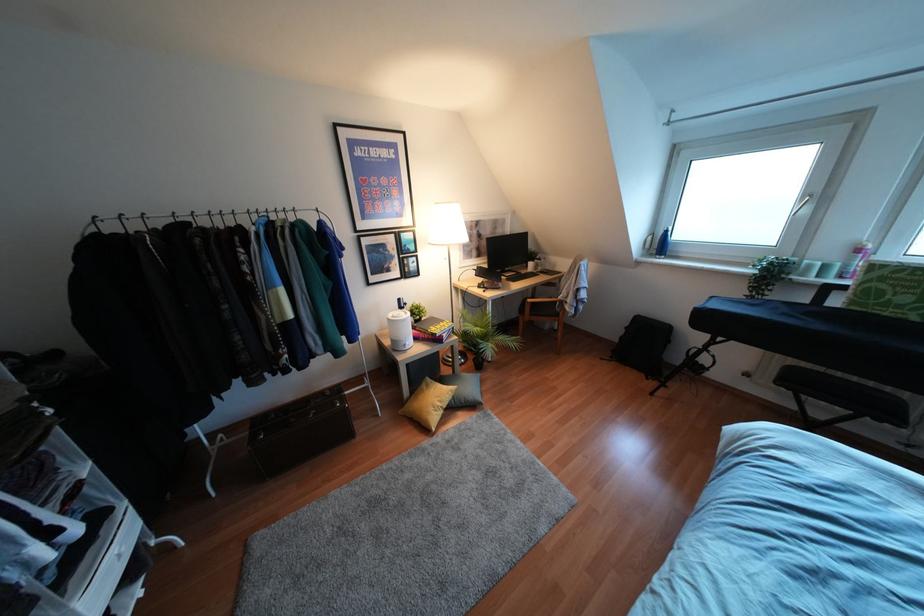
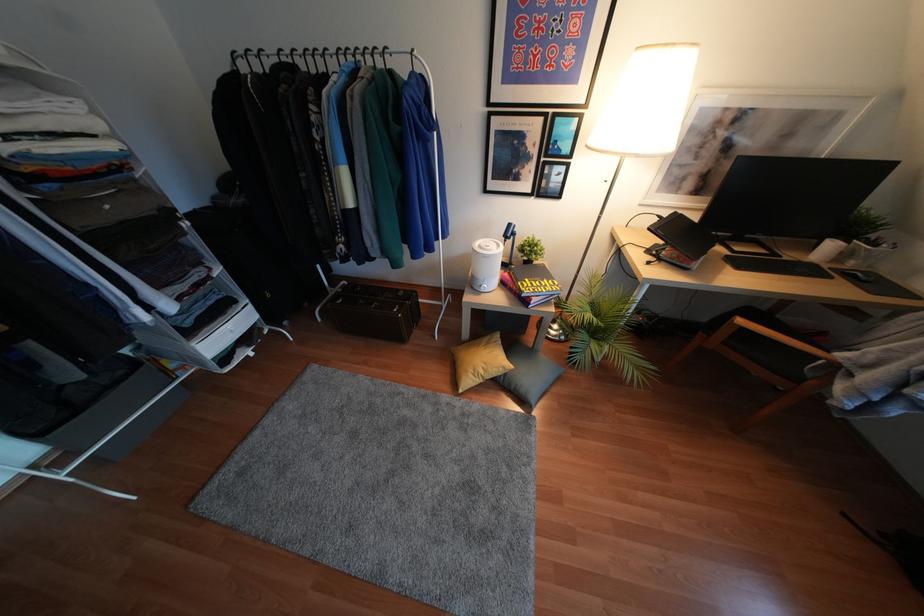
In the second image, find the point that corresponds to the point at 407,347 in the first image.

(481, 290)